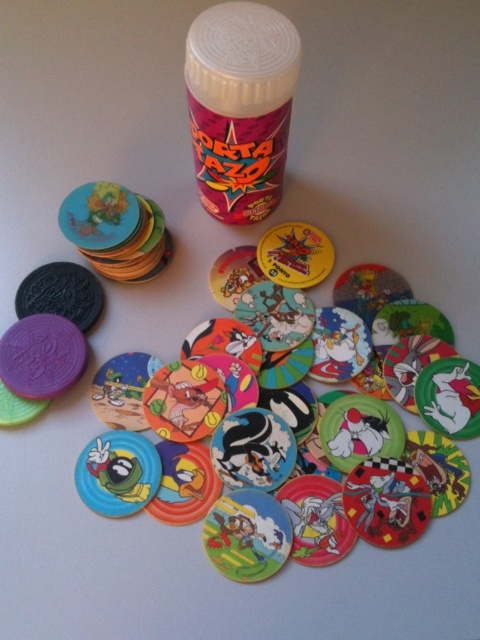
Does matte plastic bottle at center have a greater height compared to matte plastic disc at center?

Incorrect, matte plastic bottle at center's height is not larger of matte plastic disc at center's.

Is matte plastic bottle at center to the left of matte plastic disc at center from the viewer's perspective?

Correct, you'll find matte plastic bottle at center to the left of matte plastic disc at center.

The image size is (480, 640). What are the coordinates of `matte plastic bottle at center` in the screenshot? It's located at (240, 106).